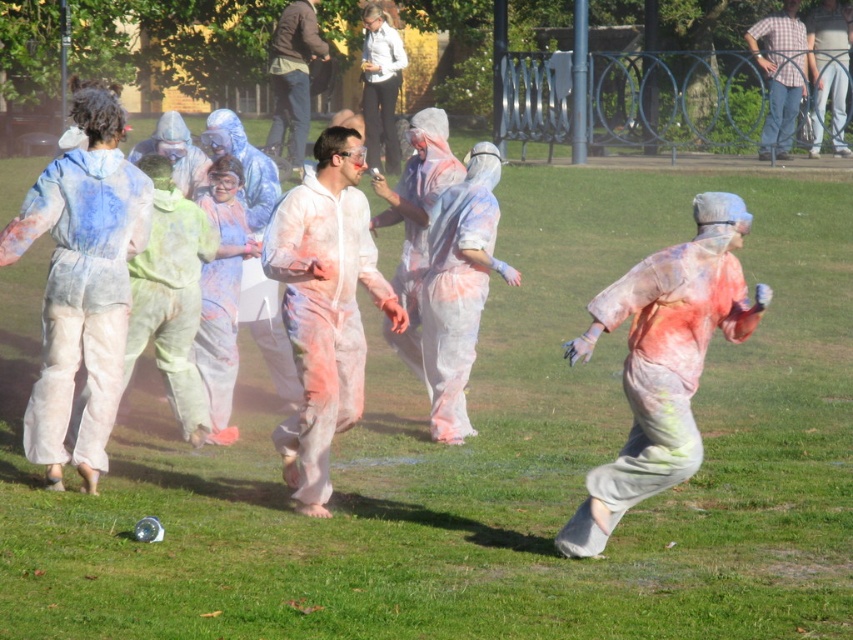
Can you confirm if speckled fabric man at center is positioned to the right of brown leather jacket at upper center?

Indeed, speckled fabric man at center is positioned on the right side of brown leather jacket at upper center.

Is speckled fabric man at center in front of brown leather jacket at upper center?

Yes, it is.

Locate an element on the screen. speckled fabric man at center is located at coordinates (663, 362).

The height and width of the screenshot is (640, 853). Identify the location of speckled fabric man at center. (663, 362).

Is speckled fabric man at center closer to the viewer compared to white matte jumpsuit at center?

Yes, it is in front of white matte jumpsuit at center.

Which is more to the left, speckled fabric man at center or white matte jumpsuit at center?

Positioned to the left is white matte jumpsuit at center.

Identify the location of speckled fabric man at center. (663, 362).

Does brown leather jacket at upper center appear on the left side of plaid shirt at upper right?

Indeed, brown leather jacket at upper center is positioned on the left side of plaid shirt at upper right.

Who is more distant from viewer, (276, 92) or (792, 108)?

The point (276, 92) is behind.

Is point (292, 106) farther from camera compared to point (749, 49)?

No, it is in front of (749, 49).

Image resolution: width=853 pixels, height=640 pixels. Identify the location of brown leather jacket at upper center. (293, 76).